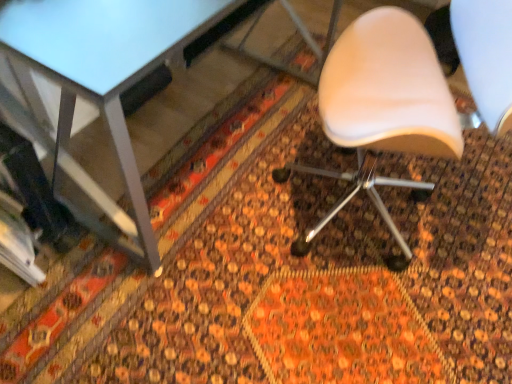
Find the location of a particular element. Image resolution: width=512 pixels, height=384 pixels. vacant area that is in front of white leather chair at center is located at coordinates (348, 321).